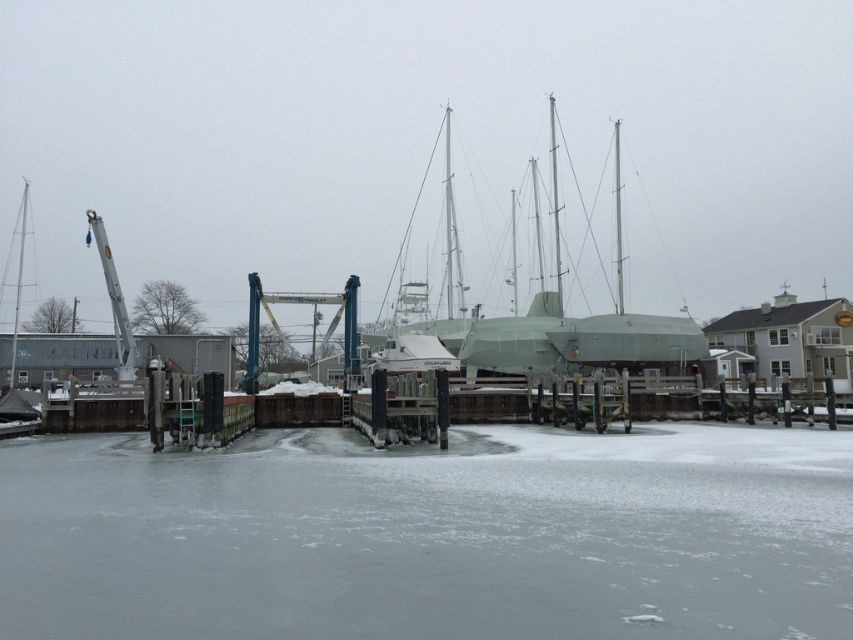
Can you confirm if frozen ice at lower center is smaller than green matte sailboat at center?

Correct, frozen ice at lower center occupies less space than green matte sailboat at center.

In the scene shown: Does frozen ice at lower center come in front of green matte sailboat at center?

Yes, frozen ice at lower center is in front of green matte sailboat at center.

Does point (102, 504) lie behind point (527, 355)?

No, it is not.

Find the location of `frozen ice at lower center`. frozen ice at lower center is located at coordinates (432, 536).

Consider the image. Between green matte sailboat at center and blue metallic crane at center, which one has less height?

Standing shorter between the two is blue metallic crane at center.

Which is behind, point (538, 291) or point (251, 358)?

Point (538, 291)

Locate an element on the screen. Image resolution: width=853 pixels, height=640 pixels. green matte sailboat at center is located at coordinates (573, 323).

This screenshot has width=853, height=640. I want to click on green matte sailboat at center, so click(x=573, y=323).

Who is lower down, frozen ice at lower center or blue metallic crane at center?

frozen ice at lower center is lower down.

Is point (515, 538) farther from camera compared to point (263, 300)?

No, (515, 538) is in front of (263, 300).

Locate an element on the screen. This screenshot has width=853, height=640. frozen ice at lower center is located at coordinates (432, 536).